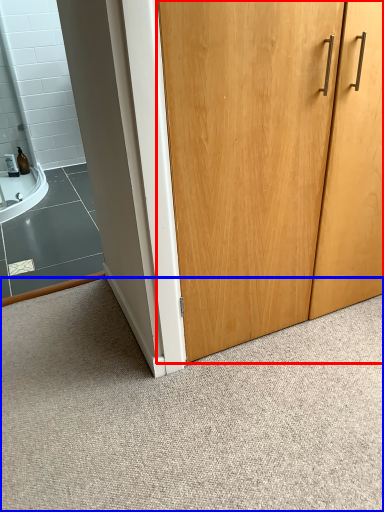
Question: Which of the following is the farthest to the observer, door (highlighted by a red box) or granite (highlighted by a blue box)?

Choices:
 (A) door
 (B) granite

Answer: (A)